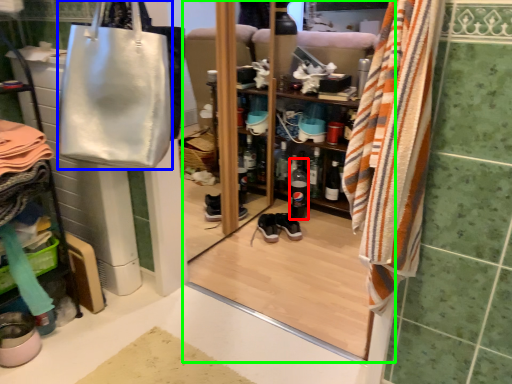
Question: Which object is the closest to the bottle (highlighted by a red box)? Choose among these: handbag (highlighted by a blue box) or screen door (highlighted by a green box).

Choices:
 (A) handbag
 (B) screen door

Answer: (B)